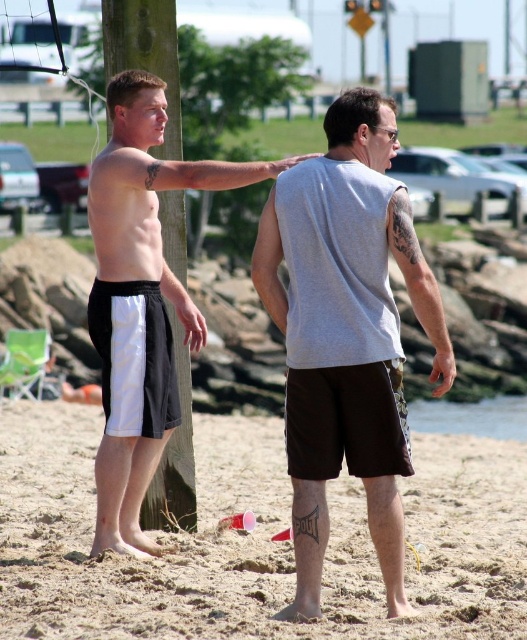
Question: Which point appears closest to the camera in this image?

Choices:
 (A) (320, 461)
 (B) (80, 621)

Answer: (B)

Question: Estimate the real-world distances between objects in this image. Which object is farther from the black matte shorts at left?

Choices:
 (A) gray matte tank top at center
 (B) sandy beach at lower center

Answer: (B)

Question: Among these objects, which one is farthest from the camera?

Choices:
 (A) sandy beach at lower center
 (B) black matte shorts at left
 (C) gray matte tank top at center

Answer: (B)

Question: Is sandy beach at lower center in front of black matte shorts at left?

Choices:
 (A) yes
 (B) no

Answer: (A)

Question: Does sandy beach at lower center have a lesser width compared to black matte shorts at left?

Choices:
 (A) yes
 (B) no

Answer: (B)

Question: Does sandy beach at lower center appear under black matte shorts at left?

Choices:
 (A) no
 (B) yes

Answer: (B)